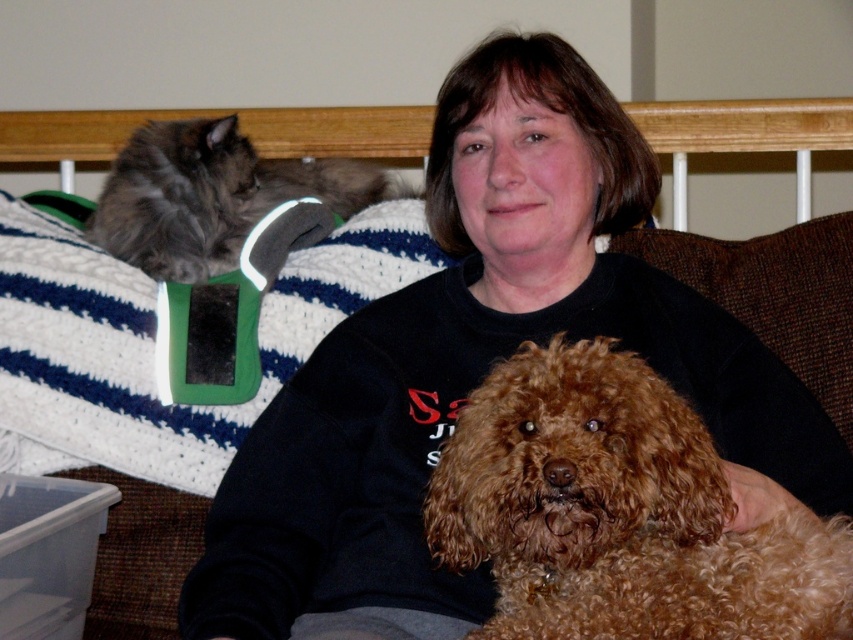
Question: Is brown curly fur dog at center below gray fluffy cat at upper left?

Choices:
 (A) no
 (B) yes

Answer: (B)

Question: Can you confirm if brown curly fur dog at center is positioned above gray fluffy cat at upper left?

Choices:
 (A) no
 (B) yes

Answer: (A)

Question: Among these objects, which one is farthest from the camera?

Choices:
 (A) gray fluffy cat at upper left
 (B) brown curly fur dog at center

Answer: (A)

Question: Is brown curly fur dog at center thinner than gray fluffy cat at upper left?

Choices:
 (A) no
 (B) yes

Answer: (B)